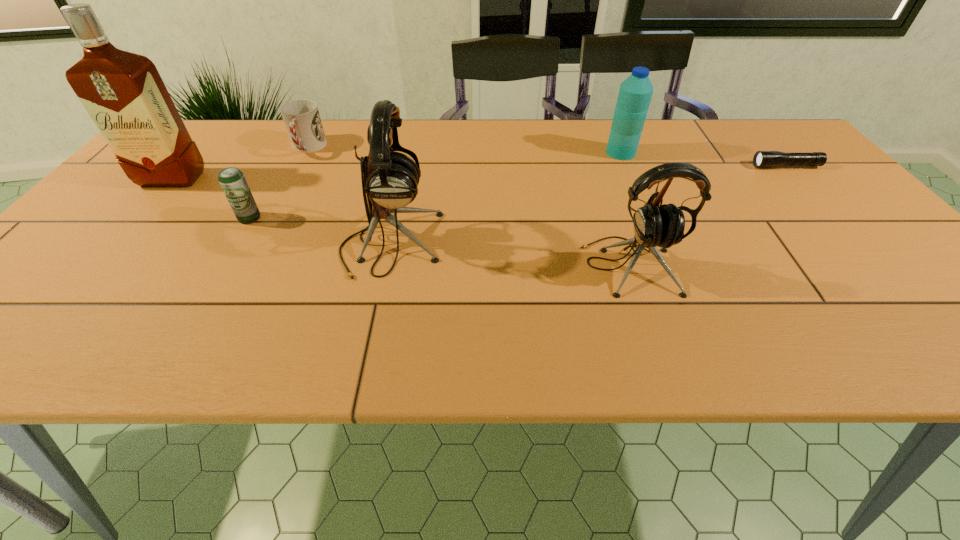
Please point a spot on the right to add another earphone. Please provide its 2D coordinates. Your answer should be formatted as a tuple, i.e. [(x, y)], where the tuple contains the x and y coordinates of a point satisfying the conditions above.

[(894, 290)]